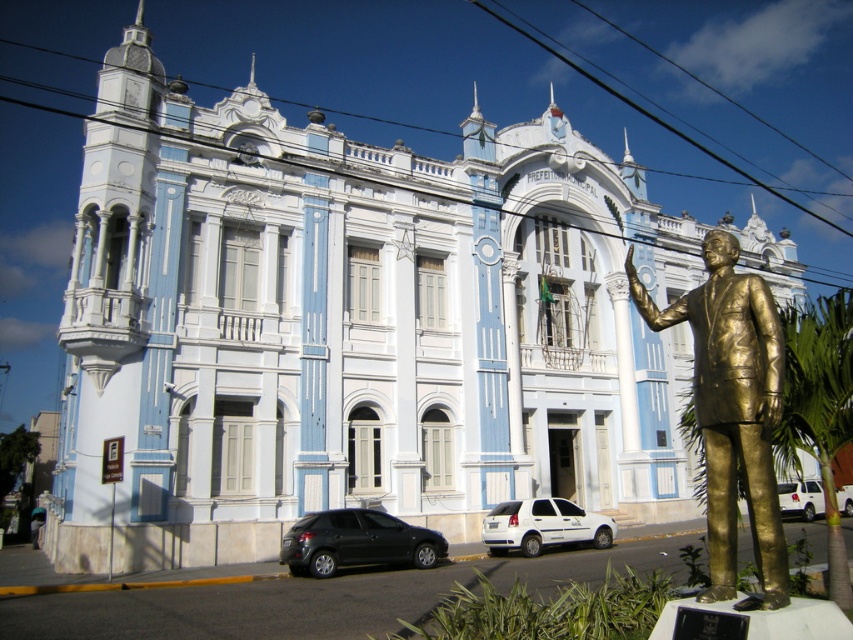
You are driving a matte black hatchback at lower center and want to park it in a parking spot that is exactly 4 meters away from where you are currently positioned. Is the distance between your current position and the parking spot sufficient for you to safely park without needing to reverse?

The distance between the matte black hatchback at lower center and the camera is 41.82 meters. Since the parking spot is only 4 meters away, the distance is more than enough for safe parking without reversing.